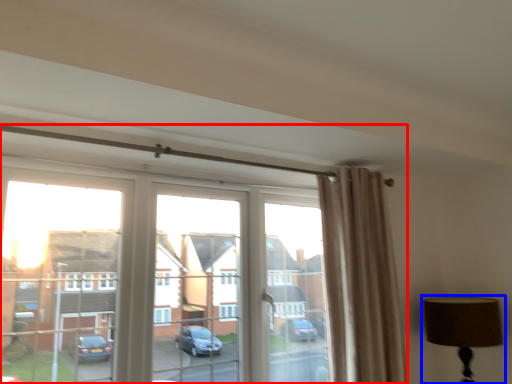
Question: Which of the following is the closest to the observer, window (highlighted by a red box) or table lamp (highlighted by a blue box)?

Choices:
 (A) window
 (B) table lamp

Answer: (A)